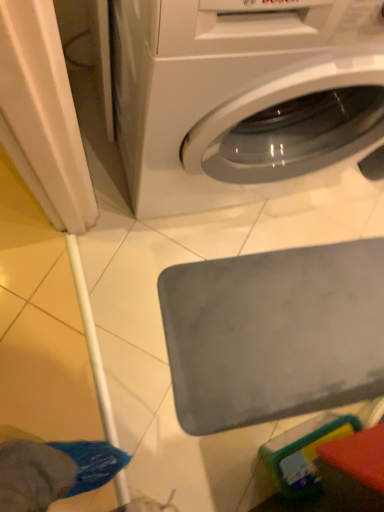
Question: Which direction should I rotate to look at white glossy washing machine at upper center?

Choices:
 (A) right
 (B) left

Answer: (A)